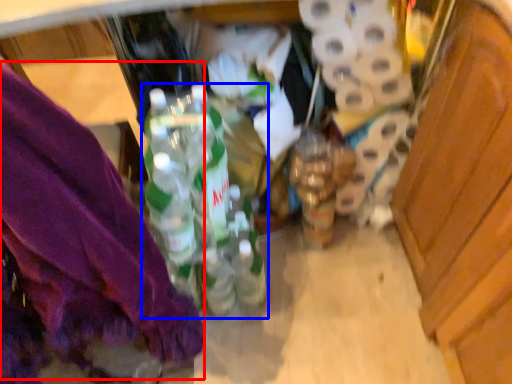
Question: Which object appears farthest to the camera in this image, underclothes (highlighted by a red box) or bottle (highlighted by a blue box)?

Choices:
 (A) underclothes
 (B) bottle

Answer: (B)